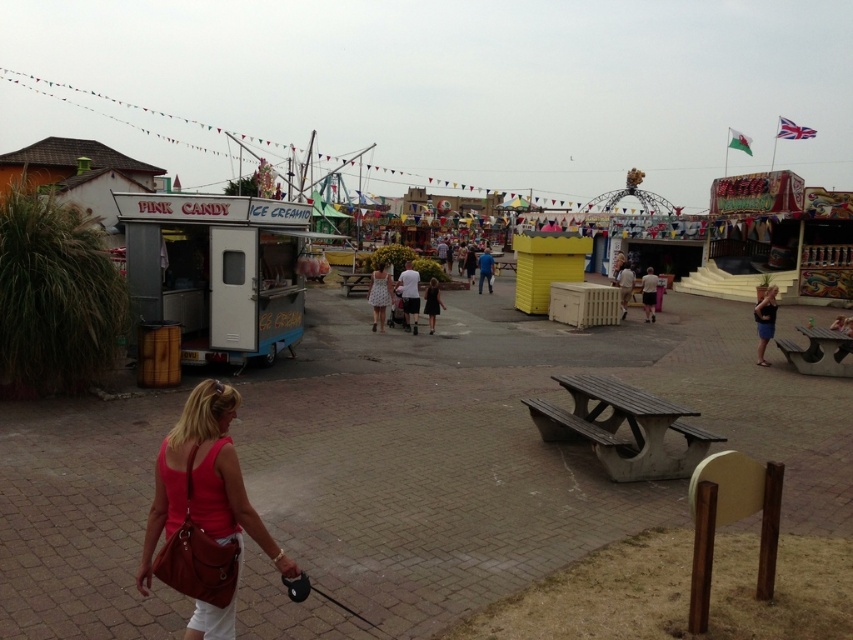
Question: Which object appears farthest from the camera in this image?

Choices:
 (A) light brown leather jacket at center
 (B) matte brown purse at lower left
 (C) dark blue jeans at lower right

Answer: (A)

Question: Can you confirm if dark blue jeans at lower right is positioned to the left of light brown leather jacket at center?

Choices:
 (A) yes
 (B) no

Answer: (B)

Question: Which point is farther to the camera?

Choices:
 (A) (654, 298)
 (B) (480, 259)
 (C) (622, 272)
 (D) (378, 310)

Answer: (B)

Question: Is light brown leather jacket at center thinner than blue fabric shirt at center?

Choices:
 (A) no
 (B) yes

Answer: (B)

Question: Is light brown wooden bench at center positioned in front of blue fabric shirt at center?

Choices:
 (A) yes
 (B) no

Answer: (A)

Question: Which object appears farthest from the camera in this image?

Choices:
 (A) white cotton dress at center
 (B) light brown leather jacket at center
 (C) dark blue jeans at lower right

Answer: (B)